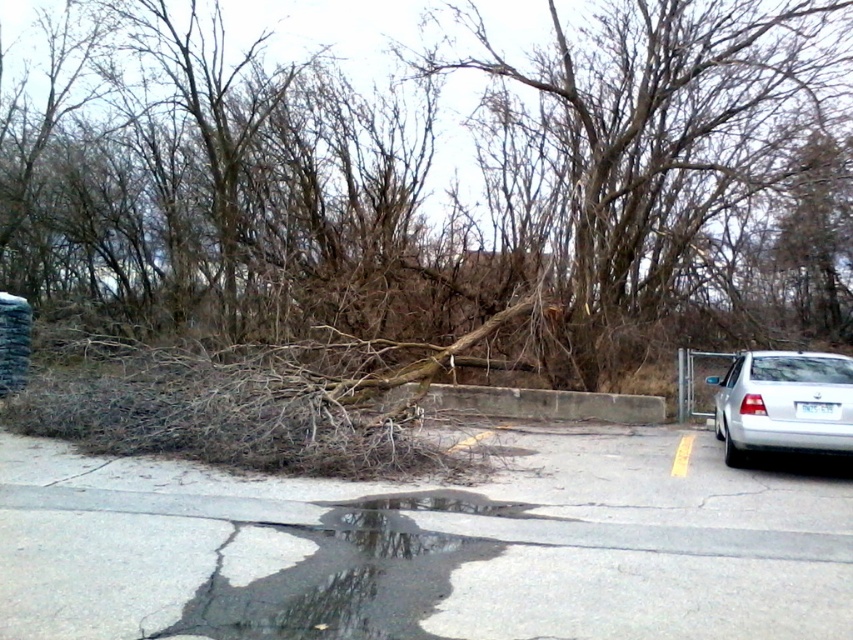
Question: Which point appears farthest from the camera in this image?

Choices:
 (A) (123, 128)
 (B) (799, 400)

Answer: (A)

Question: Where is transparent wet asphalt at lower center located in relation to silver metallic sedan at right in the image?

Choices:
 (A) above
 (B) below

Answer: (B)

Question: Which point is closer to the camera?

Choices:
 (A) (524, 246)
 (B) (836, 378)

Answer: (B)

Question: Which point is farther from the camera taking this photo?

Choices:
 (A) (132, 336)
 (B) (225, 625)
 (C) (717, 403)

Answer: (A)

Question: Does brown dry branches at center have a greater width compared to silver metallic sedan at right?

Choices:
 (A) yes
 (B) no

Answer: (A)

Question: Is brown dry branches at center further to the viewer compared to silver metallic sedan at right?

Choices:
 (A) no
 (B) yes

Answer: (B)